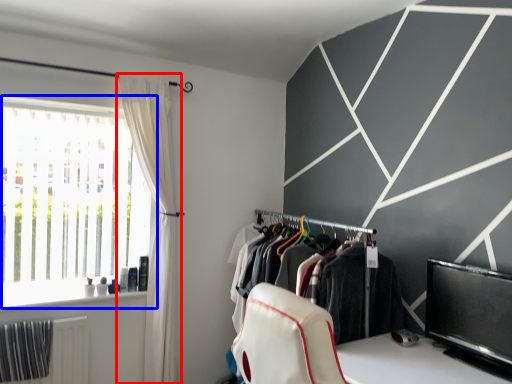
Question: Among these objects, which one is nearest to the camera, curtain (highlighted by a red box) or window (highlighted by a blue box)?

Choices:
 (A) curtain
 (B) window

Answer: (B)